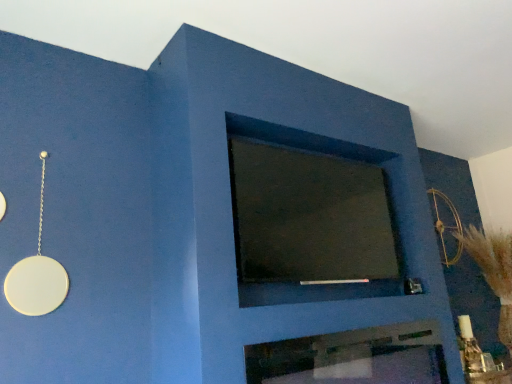
Question: From the image's perspective, is dark matte glass at center below metallic silver fireplace at center?

Choices:
 (A) yes
 (B) no

Answer: (B)

Question: Considering the relative positions of dark matte glass at center and metallic silver fireplace at center in the image provided, is dark matte glass at center to the right of metallic silver fireplace at center from the viewer's perspective?

Choices:
 (A) yes
 (B) no

Answer: (B)

Question: From the image's perspective, would you say dark matte glass at center is positioned over metallic silver fireplace at center?

Choices:
 (A) no
 (B) yes

Answer: (B)

Question: Is dark matte glass at center positioned with its back to metallic silver fireplace at center?

Choices:
 (A) yes
 (B) no

Answer: (B)

Question: Would you consider dark matte glass at center to be distant from metallic silver fireplace at center?

Choices:
 (A) yes
 (B) no

Answer: (B)

Question: Is metallic silver fireplace at center bigger or smaller than dark matte glass at center?

Choices:
 (A) small
 (B) big

Answer: (A)

Question: Considering the positions of metallic silver fireplace at center and dark matte glass at center in the image, is metallic silver fireplace at center wider or thinner than dark matte glass at center?

Choices:
 (A) thin
 (B) wide

Answer: (A)

Question: Is metallic silver fireplace at center taller or shorter than dark matte glass at center?

Choices:
 (A) short
 (B) tall

Answer: (A)

Question: From a real-world perspective, is metallic silver fireplace at center positioned above or below dark matte glass at center?

Choices:
 (A) above
 (B) below

Answer: (B)

Question: In the image, is dark matte glass at center on the left side or the right side of gold metallic bow at upper right?

Choices:
 (A) left
 (B) right

Answer: (A)

Question: From the image's perspective, relative to gold metallic bow at upper right, is dark matte glass at center above or below?

Choices:
 (A) below
 (B) above

Answer: (B)

Question: From a real-world perspective, is dark matte glass at center physically located above or below gold metallic bow at upper right?

Choices:
 (A) below
 (B) above

Answer: (A)

Question: Considering the positions of dark matte glass at center and gold metallic bow at upper right in the image, is dark matte glass at center bigger or smaller than gold metallic bow at upper right?

Choices:
 (A) big
 (B) small

Answer: (A)

Question: From the image's perspective, is dark matte glass at center positioned above or below metallic silver fireplace at center?

Choices:
 (A) above
 (B) below

Answer: (A)

Question: Is dark matte glass at center inside the boundaries of metallic silver fireplace at center, or outside?

Choices:
 (A) inside
 (B) outside

Answer: (B)